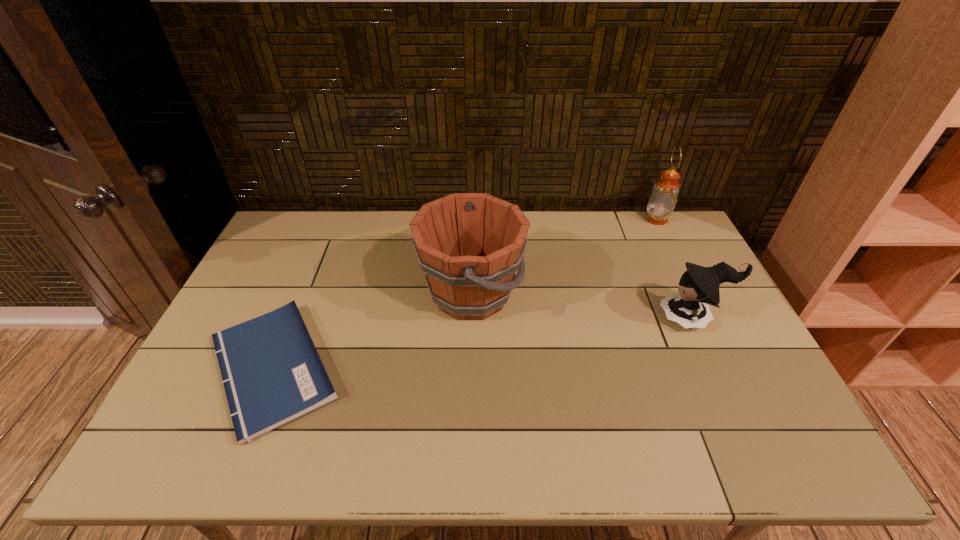
This screenshot has width=960, height=540. Find the location of `vacant space situated on the right of the leftmost object`. vacant space situated on the right of the leftmost object is located at coordinates (448, 368).

The image size is (960, 540). Identify the location of object that is positioned at the far edge. (663, 199).

Where is `object situated at the near edge`? object situated at the near edge is located at coordinates (272, 373).

Locate an element on the screen. object present at the left edge is located at coordinates (272, 373).

Find the location of a particular element. This screenshot has height=540, width=960. oil lamp located at the right edge is located at coordinates (663, 199).

At what (x,y) coordinates should I click in order to perform the action: click on doll that is at the right edge. Please return your answer as a coordinate pair (x, y). The height and width of the screenshot is (540, 960). Looking at the image, I should click on (699, 285).

Where is `object situated at the near left corner`? This screenshot has height=540, width=960. object situated at the near left corner is located at coordinates pyautogui.click(x=272, y=373).

You are a GUI agent. You are given a task and a screenshot of the screen. Output one action in this format:
    pyautogui.click(x=<x>, y=<y>)
    Task: Click on the object at the far right corner
    
    Given the screenshot: What is the action you would take?
    pyautogui.click(x=663, y=199)

The width and height of the screenshot is (960, 540). Find the location of `free region at the far edge of the desktop`. free region at the far edge of the desktop is located at coordinates (535, 217).

In the image, there is a desktop. Identify the location of free space at the near edge. The image size is (960, 540). (509, 437).